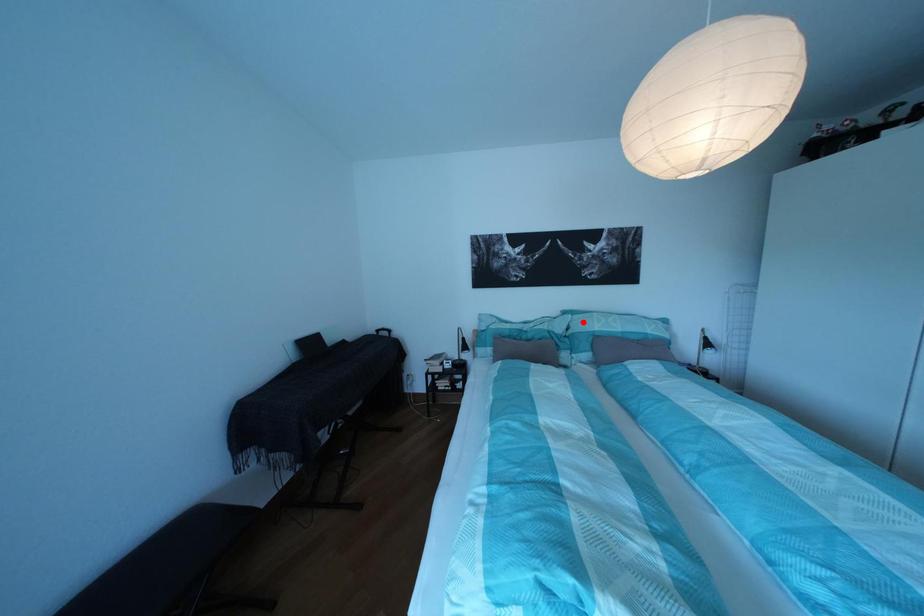
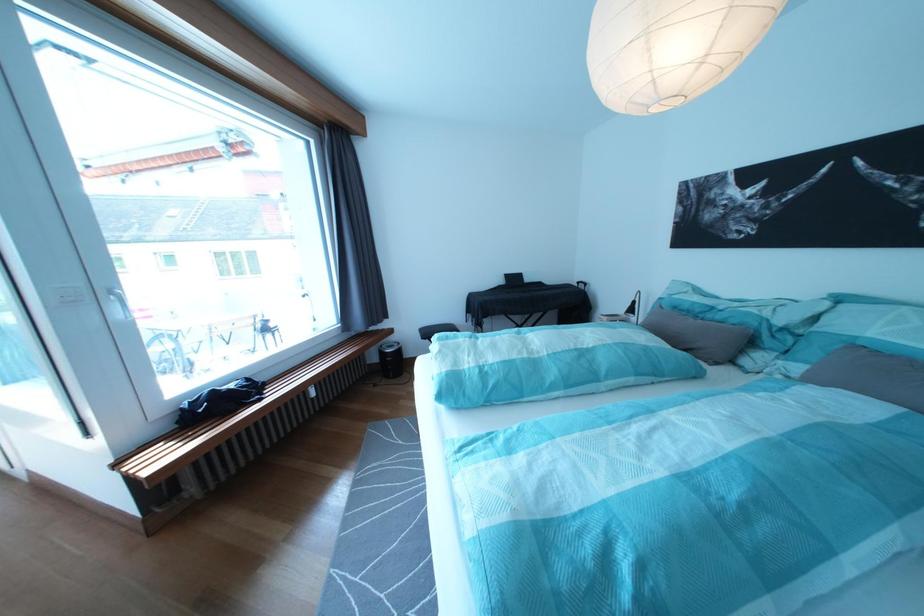
In the second image, find the point that corresponds to the highlighted location in the first image.

(841, 309)